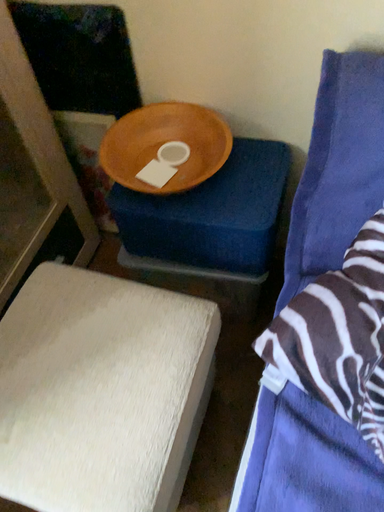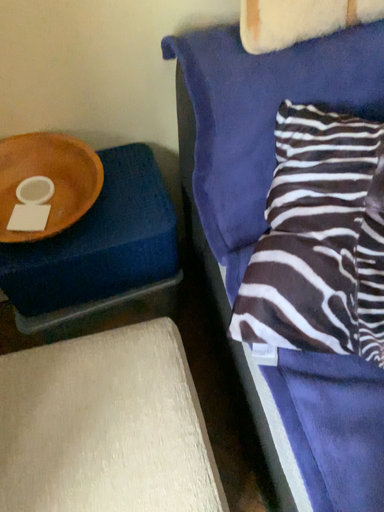
Question: How did the camera likely rotate when shooting the video?

Choices:
 (A) rotated upward
 (B) rotated downward

Answer: (A)